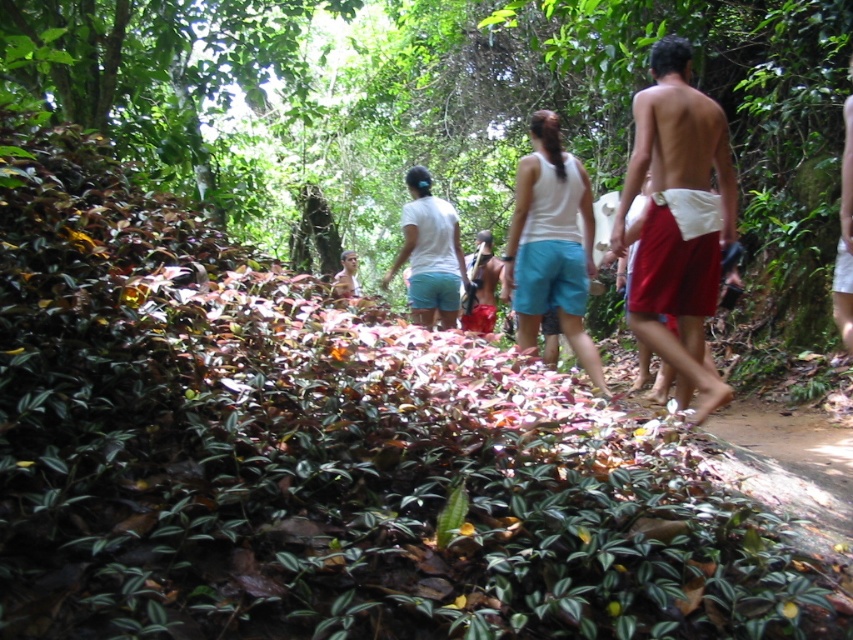
Does red fabric shorts at right have a greater height compared to white fabric shorts at center?

Yes, red fabric shorts at right is taller than white fabric shorts at center.

Measure the distance between red fabric shorts at right and white fabric shorts at center.

1.03 meters

Where is `red fabric shorts at right`? red fabric shorts at right is located at coordinates (677, 220).

Between red fabric shorts at right and white cotton shirt at center, which one appears on the right side from the viewer's perspective?

Positioned to the right is red fabric shorts at right.

The width and height of the screenshot is (853, 640). What do you see at coordinates (677, 220) in the screenshot?
I see `red fabric shorts at right` at bounding box center [677, 220].

The height and width of the screenshot is (640, 853). I want to click on red fabric shorts at right, so click(x=677, y=220).

Identify the location of red fabric shorts at right. coord(677,220).

Which of these two, white fabric shorts at center or white cotton shirt at center, stands taller?

white fabric shorts at center

Is white fabric shorts at center wider than white cotton shirt at center?

Yes.

Does point (531, 164) lie in front of point (451, 216)?

Yes, point (531, 164) is in front of point (451, 216).

Where is `white fabric shorts at center`? The image size is (853, 640). white fabric shorts at center is located at coordinates (550, 243).